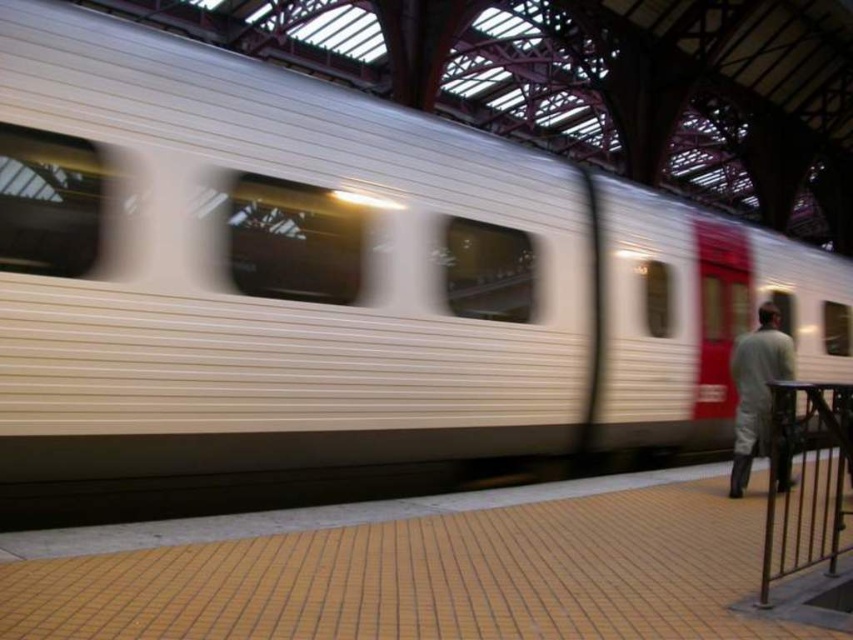
Does metallic silver rail at lower right come behind gray fabric pants at right?

No, metallic silver rail at lower right is in front of gray fabric pants at right.

Does metallic silver rail at lower right have a lesser width compared to gray fabric pants at right?

No, metallic silver rail at lower right is not thinner than gray fabric pants at right.

Where is `metallic silver rail at lower right`? This screenshot has height=640, width=853. metallic silver rail at lower right is located at coordinates (805, 480).